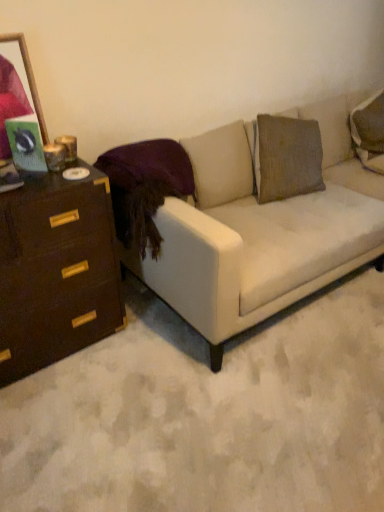
Identify the location of free location in front of white fabric couch at center. (244, 408).